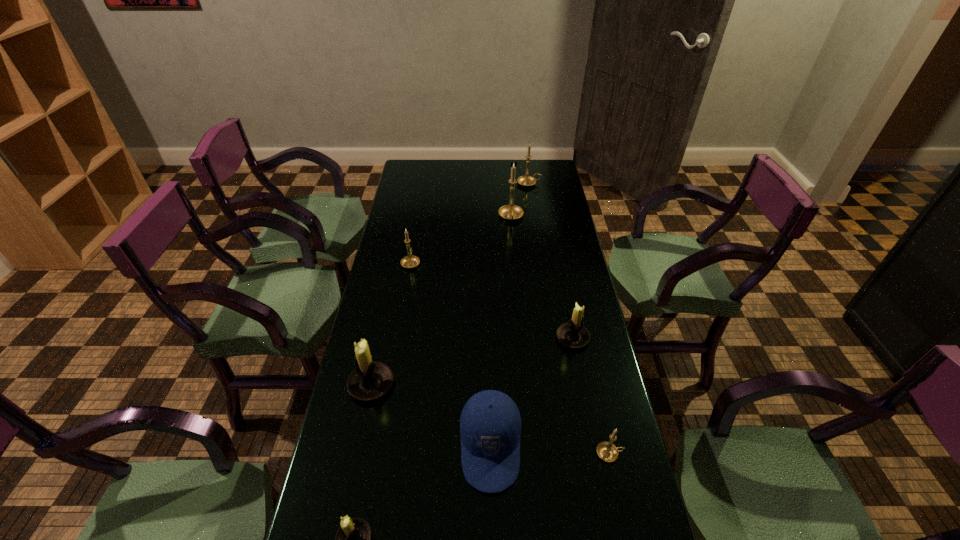
Find the location of a particular element. This screenshot has height=540, width=960. object located at the far edge is located at coordinates (526, 180).

Locate an element on the screen. Image resolution: width=960 pixels, height=540 pixels. object that is positioned at the far right corner is located at coordinates (526, 180).

The height and width of the screenshot is (540, 960). Find the location of `vacant space at the far edge of the desktop`. vacant space at the far edge of the desktop is located at coordinates (478, 170).

I want to click on blank space at the left edge of the desktop, so click(x=406, y=354).

Find the location of a particular element. vacant space at the right edge of the desktop is located at coordinates (612, 512).

The height and width of the screenshot is (540, 960). Find the location of `vacant space at the far left corner of the desktop`. vacant space at the far left corner of the desktop is located at coordinates (407, 170).

This screenshot has width=960, height=540. I want to click on free spot between the farthest gold candle holder and the rightmost white candle holder, so click(551, 261).

Image resolution: width=960 pixels, height=540 pixels. Identify the location of blank region between the second biggest white candle holder and the leftmost gold candle holder. (492, 300).

At what (x,y) coordinates should I click in order to perform the action: click on vacant space in between the biggest white candle holder and the blue cap. Please return your answer as a coordinate pair (x, y). Looking at the image, I should click on (431, 416).

Image resolution: width=960 pixels, height=540 pixels. Identify the location of blank region between the cap and the sixth nearest candle holder. (501, 333).